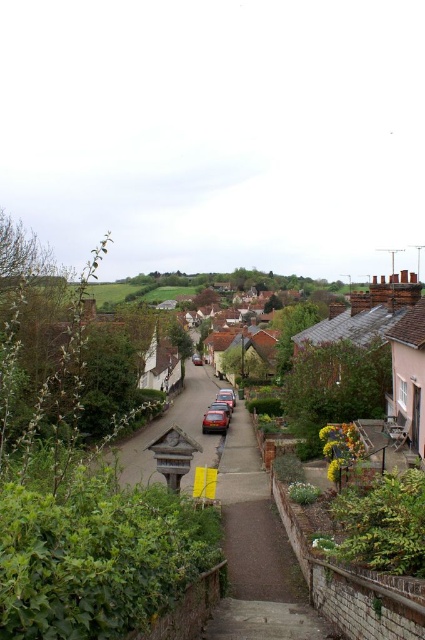
Question: Among these objects, which one is nearest to the camera?

Choices:
 (A) metallic red car at center
 (B) shiny metallic car at center

Answer: (B)

Question: Which point is closer to the camera taking this photo?

Choices:
 (A) pyautogui.click(x=217, y=410)
 (B) pyautogui.click(x=203, y=426)

Answer: (B)

Question: Is shiny metallic car at center to the left of metallic red car at center from the viewer's perspective?

Choices:
 (A) no
 (B) yes

Answer: (A)

Question: Can you confirm if shiny metallic car at center is thinner than metallic red car at center?

Choices:
 (A) yes
 (B) no

Answer: (B)

Question: Does shiny metallic car at center have a lesser width compared to metallic red car at center?

Choices:
 (A) yes
 (B) no

Answer: (B)